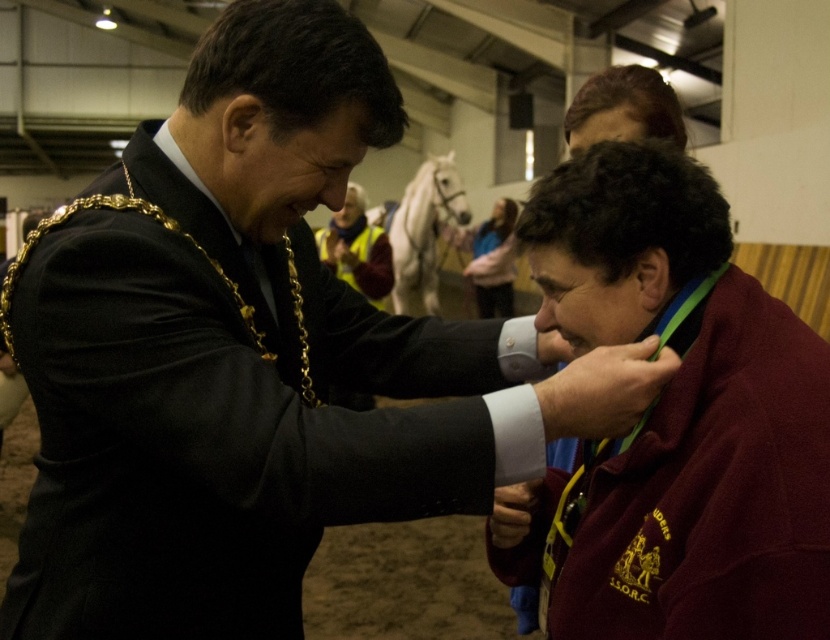
You are an event photographer and need to capture a closeup shot of the maroon jersey at center and maroon fleece at center. Which one should you focus on if you want to capture the wider object?

The maroon jersey at center is wider than the maroon fleece at center, so you should focus on the maroon jersey at center to capture the wider object.

From the picture: What is located at the coordinates point (227,417) in the image?

The maroon jersey at center is located at point (227,417).